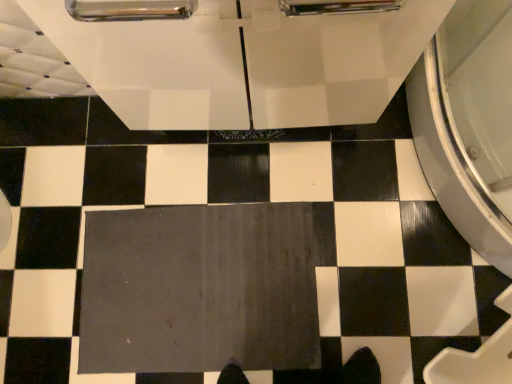
Identify the location of dark gray rubber bath mat at center. The width and height of the screenshot is (512, 384). (202, 288).

Image resolution: width=512 pixels, height=384 pixels. What do you see at coordinates (202, 288) in the screenshot? I see `dark gray rubber bath mat at center` at bounding box center [202, 288].

Find the location of a particular element. The height and width of the screenshot is (384, 512). dark gray rubber bath mat at center is located at coordinates (202, 288).